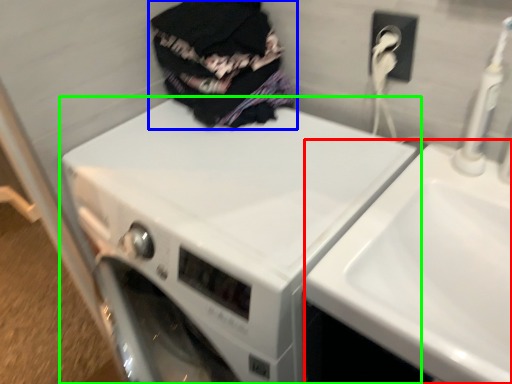
Question: Based on their relative distances, which object is farther from sink (highlighted by a red box)? Choose from clothing (highlighted by a blue box) and washing machine (highlighted by a green box).

Choices:
 (A) clothing
 (B) washing machine

Answer: (A)